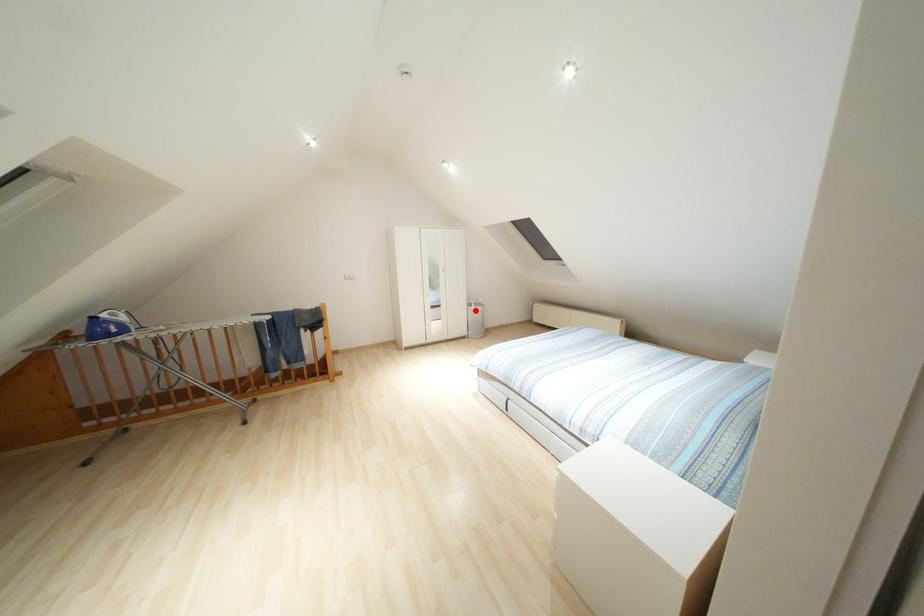
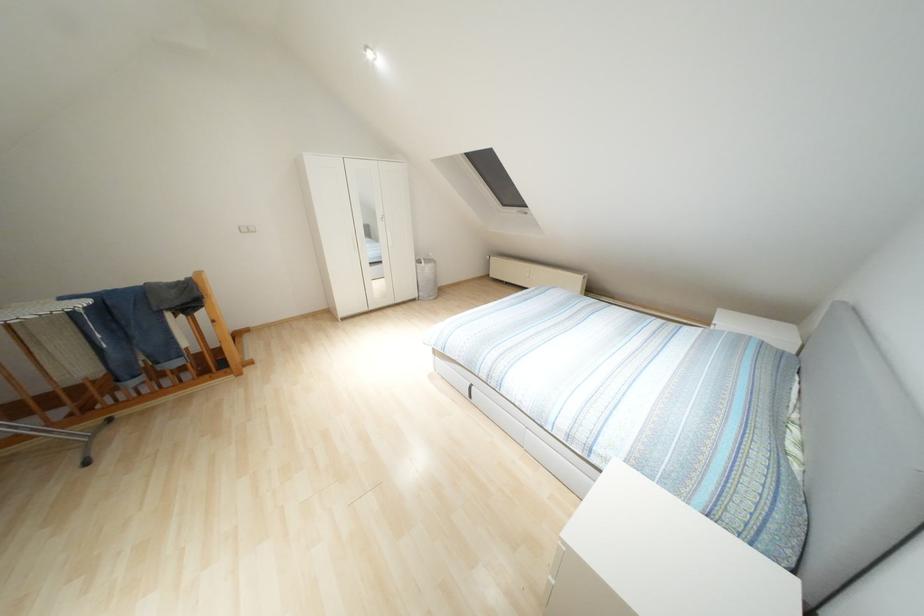
Question: I am providing you with two images of the same scene from different viewpoints. Given a red point in image1, look at the same physical point in image2. Is it:

Choices:
 (A) Closer to the viewpoint
 (B) Farther from the viewpoint

Answer: (A)